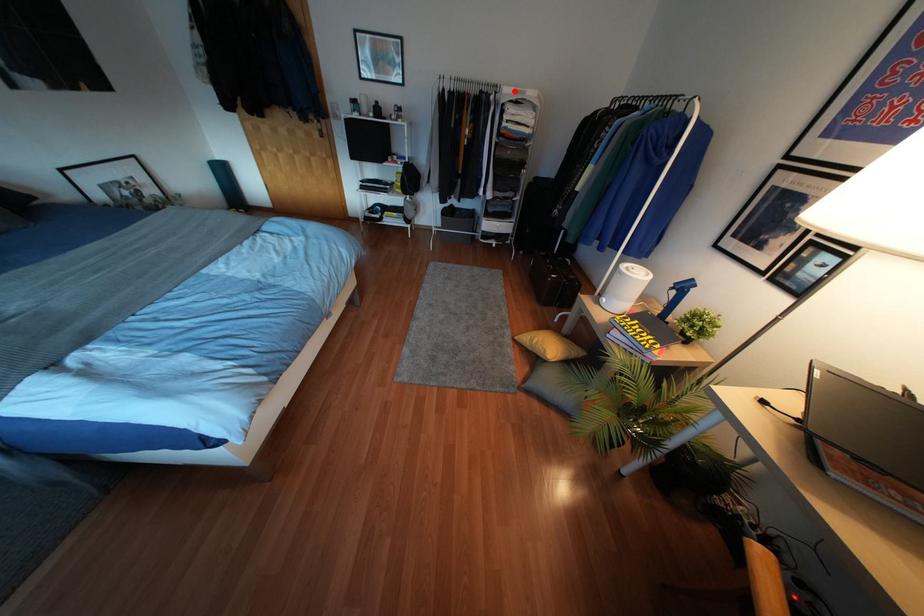
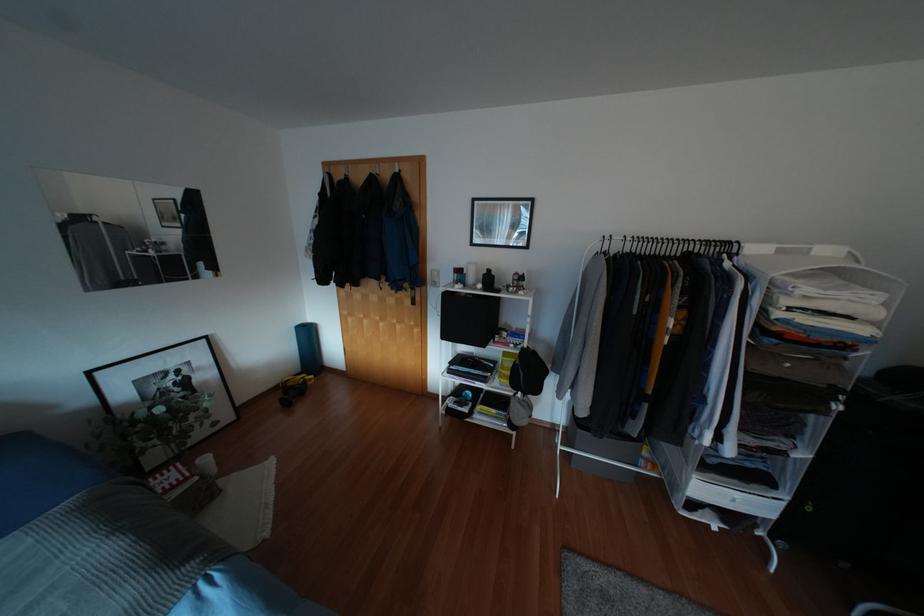
Question: I am providing you with two images of the same scene from different viewpoints. Given a red point in image1, look at the same physical point in image2. Is it:

Choices:
 (A) Closer to the viewpoint
 (B) Farther from the viewpoint

Answer: (B)